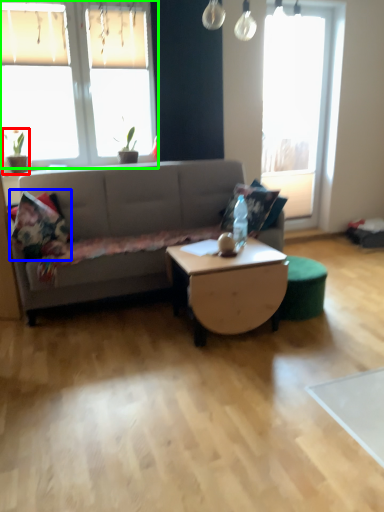
Question: Which object is positioned farthest from houseplant (highlighted by a red box)? Select from pillow (highlighted by a blue box) and window (highlighted by a green box).

Choices:
 (A) pillow
 (B) window

Answer: (A)